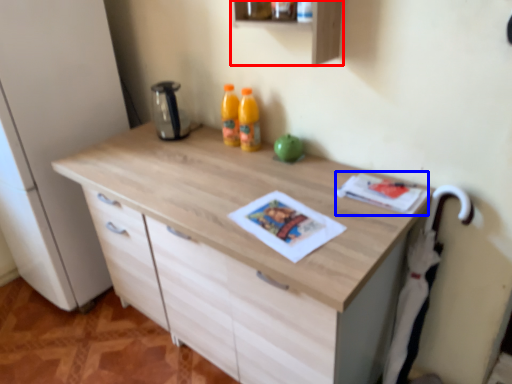
Question: Which point is further to the camera, shelf (highlighted by a red box) or magazine (highlighted by a blue box)?

Choices:
 (A) shelf
 (B) magazine

Answer: (A)